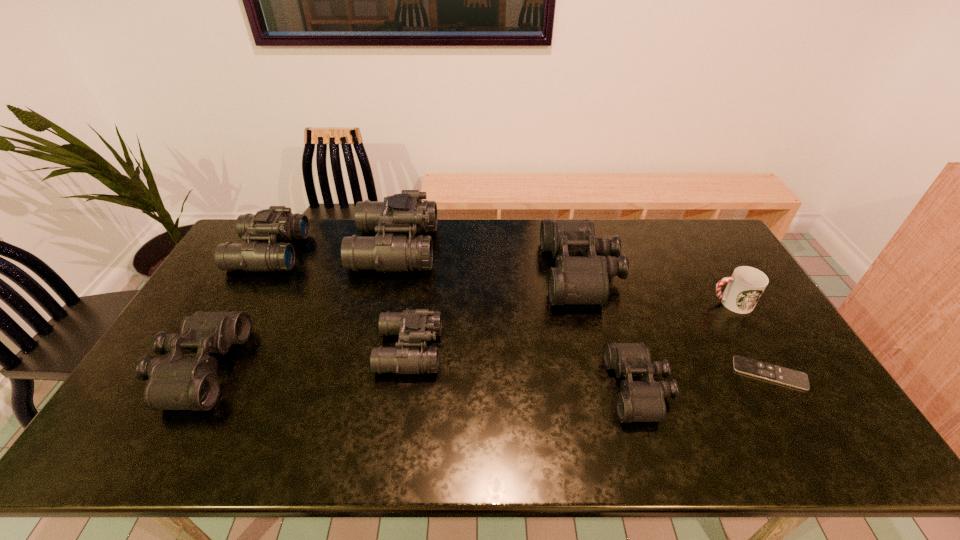
Locate an element on the screen. The height and width of the screenshot is (540, 960). vacant point located through the lenses of the biggest blue binoculars is located at coordinates click(547, 248).

Find the location of a particular element. free space located 0.300m through the lenses of the leftmost blue binoculars is located at coordinates pyautogui.click(x=387, y=252).

Where is `vacant area situated 0.400m at the eyepieces of the farthest black binoculars`? The image size is (960, 540). vacant area situated 0.400m at the eyepieces of the farthest black binoculars is located at coordinates (425, 273).

At what (x,y) coordinates should I click in order to perform the action: click on vacant space situated at the eyepieces of the farthest black binoculars. Please return your answer as a coordinate pair (x, y). Looking at the image, I should click on (515, 273).

The width and height of the screenshot is (960, 540). Find the location of `vacant position located 0.380m at the eyepieces of the farthest black binoculars`. vacant position located 0.380m at the eyepieces of the farthest black binoculars is located at coordinates (431, 273).

Locate an element on the screen. Image resolution: width=960 pixels, height=540 pixels. vacant area situated 0.240m through the lenses of the smallest blue binoculars is located at coordinates (526, 350).

I want to click on free location located at the eyepieces of the leftmost black binoculars, so click(x=331, y=368).

At what (x,y) coordinates should I click in order to perform the action: click on vacant area situated on the side of the cup where the handle is located. Please return your answer as a coordinate pair (x, y). This screenshot has width=960, height=540. Looking at the image, I should click on coord(606,303).

At what (x,y) coordinates should I click in order to perform the action: click on vacant space located on the side of the cup where the handle is located. Please return your answer as a coordinate pair (x, y). This screenshot has height=540, width=960. Looking at the image, I should click on (641, 303).

The width and height of the screenshot is (960, 540). I want to click on vacant area situated 0.400m on the side of the cup where the handle is located, so click(x=580, y=303).